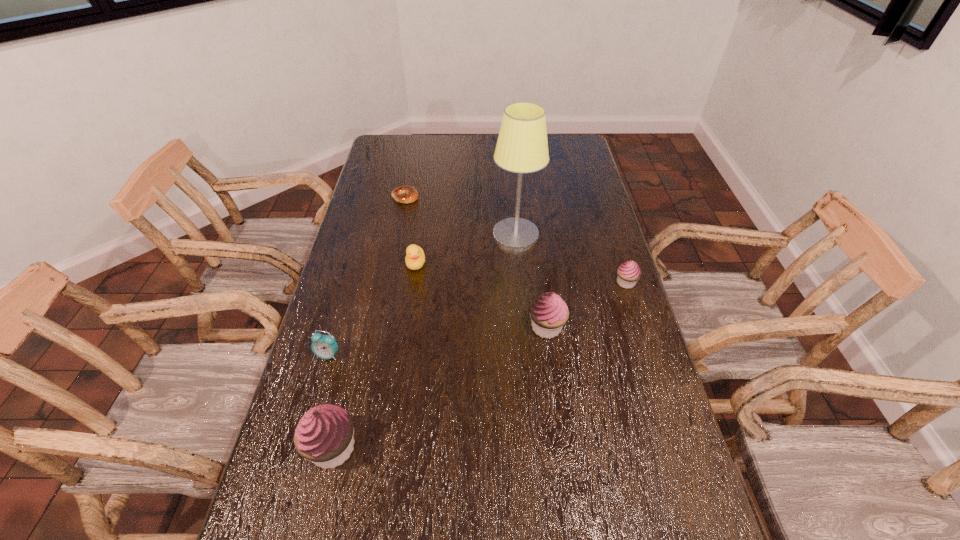
Please determine a free point for an extra cupcake to ensure balance. Please provide its 2D coordinates. Your answer should be formatted as a tuple, i.e. [(x, y)], where the tuple contains the x and y coordinates of a point satisfying the conditions above.

[(451, 381)]